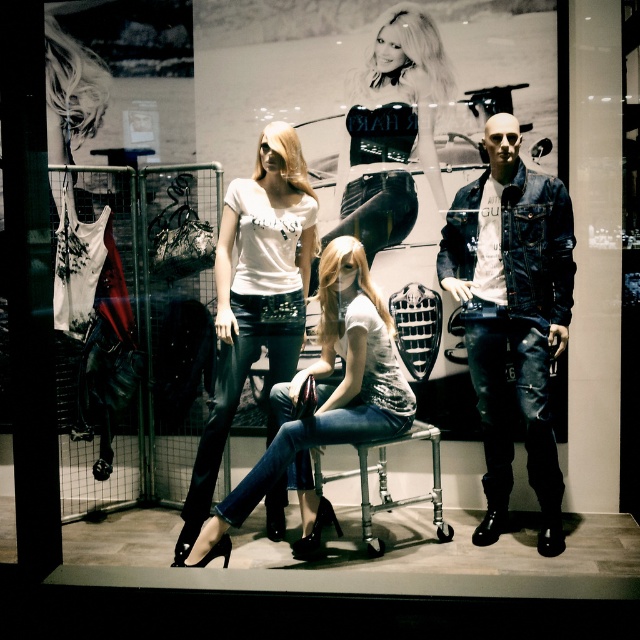
Is denim jacket at center taller than shiny black leather top at upper center?

Yes, denim jacket at center is taller than shiny black leather top at upper center.

Who is higher up, denim jacket at center or shiny black leather top at upper center?

shiny black leather top at upper center

Measure the distance between denim jacket at center and camera.

denim jacket at center and camera are 3.37 meters apart.

This screenshot has width=640, height=640. In order to click on denim jacket at center in this screenshot , I will do `click(513, 316)`.

Between denim jacket at center and denim jeans at center, which one has more height?

Standing taller between the two is denim jacket at center.

Between point (493, 410) and point (323, 422), which one is positioned behind?

The point (493, 410) is behind.

This screenshot has width=640, height=640. What are the coordinates of `denim jacket at center` in the screenshot? It's located at (513, 316).

Does white matte t-shirt at center have a lesser width compared to denim jeans at center?

Correct, white matte t-shirt at center's width is less than denim jeans at center's.

Which is more to the right, white matte t-shirt at center or denim jeans at center?

Positioned to the right is denim jeans at center.

Where is `white matte t-shirt at center`? The height and width of the screenshot is (640, 640). white matte t-shirt at center is located at coordinates (253, 296).